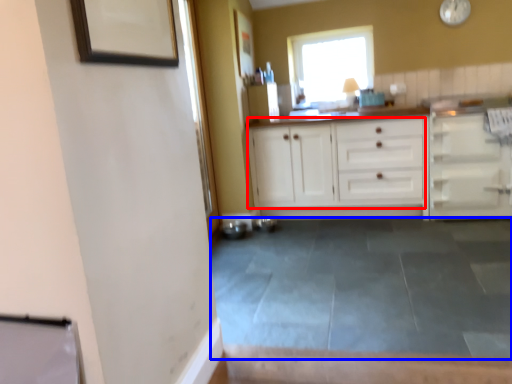
Question: Which object is further to the camera taking this photo, cabinetry (highlighted by a red box) or concrete (highlighted by a blue box)?

Choices:
 (A) cabinetry
 (B) concrete

Answer: (A)